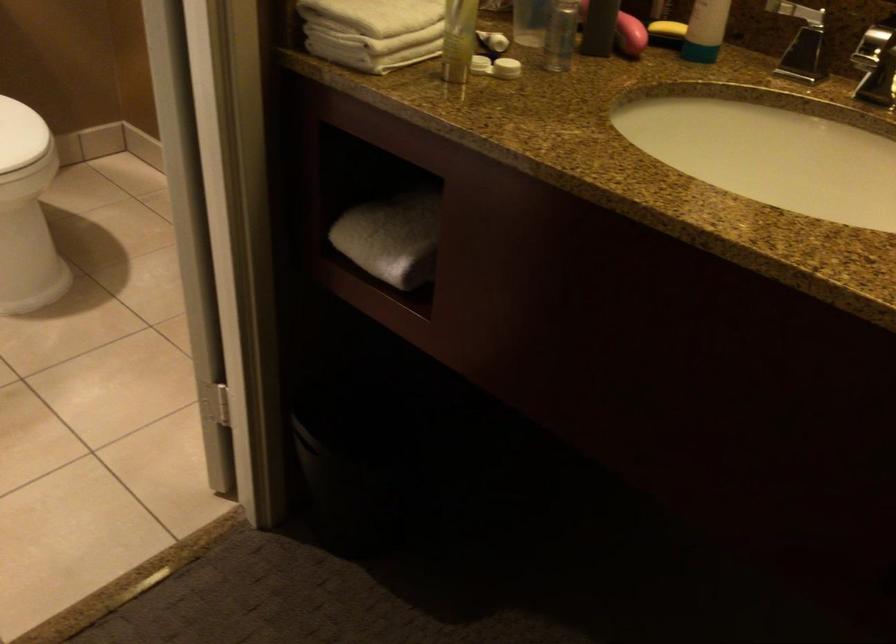
What do you see at coordinates (392, 238) in the screenshot? I see `the rolled white towel` at bounding box center [392, 238].